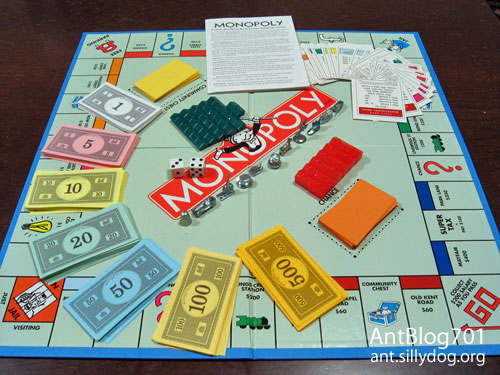
Identify the location of monopoly currency. (293, 279), (209, 295), (128, 286), (97, 251), (77, 189), (88, 147), (118, 105).